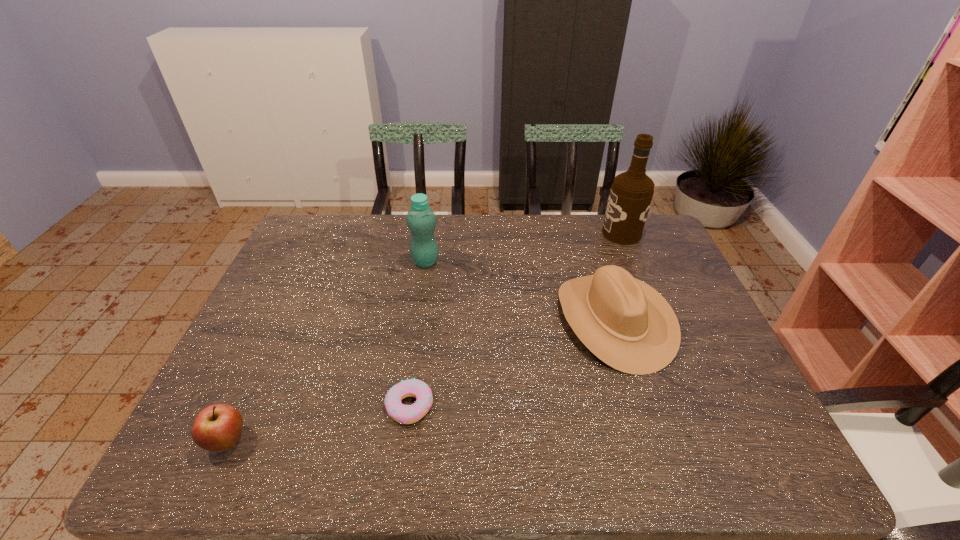
You are a GUI agent. You are given a task and a screenshot of the screen. Output one action in this format:
    pyautogui.click(x=<x>, y=<y>)
    Task: Click on the vacant area that lies between the cowboy hat and the leftmost object
    
    Given the screenshot: What is the action you would take?
    pyautogui.click(x=421, y=380)

Locate an element on the screen. empty location between the fourth shortest object and the farthest object is located at coordinates coord(523,247).

This screenshot has height=540, width=960. What are the coordinates of `free space between the water bottle and the doughnut` in the screenshot? It's located at (418, 334).

Where is `free space between the third farthest object and the doughnut`? This screenshot has height=540, width=960. free space between the third farthest object and the doughnut is located at coordinates (512, 363).

This screenshot has width=960, height=540. Find the location of `empty space between the alcohol and the fourth nearest object`. empty space between the alcohol and the fourth nearest object is located at coordinates (523, 247).

Where is `free area in between the shortest object and the tallest object`? The width and height of the screenshot is (960, 540). free area in between the shortest object and the tallest object is located at coordinates (516, 320).

Identify the location of free space that is in between the tallest object and the leftmost object. The image size is (960, 540). (424, 337).

The image size is (960, 540). In order to click on vacant point located between the second farthest object and the doughnut in this screenshot , I will do `click(418, 334)`.

In order to click on free space between the shortest object and the fourth nearest object in this screenshot , I will do `click(418, 334)`.

You are a GUI agent. You are given a task and a screenshot of the screen. Output one action in this format:
    pyautogui.click(x=<x>, y=<y>)
    Task: Click on the object that stands as the second closest to the doughnut
    
    Given the screenshot: What is the action you would take?
    pyautogui.click(x=626, y=323)